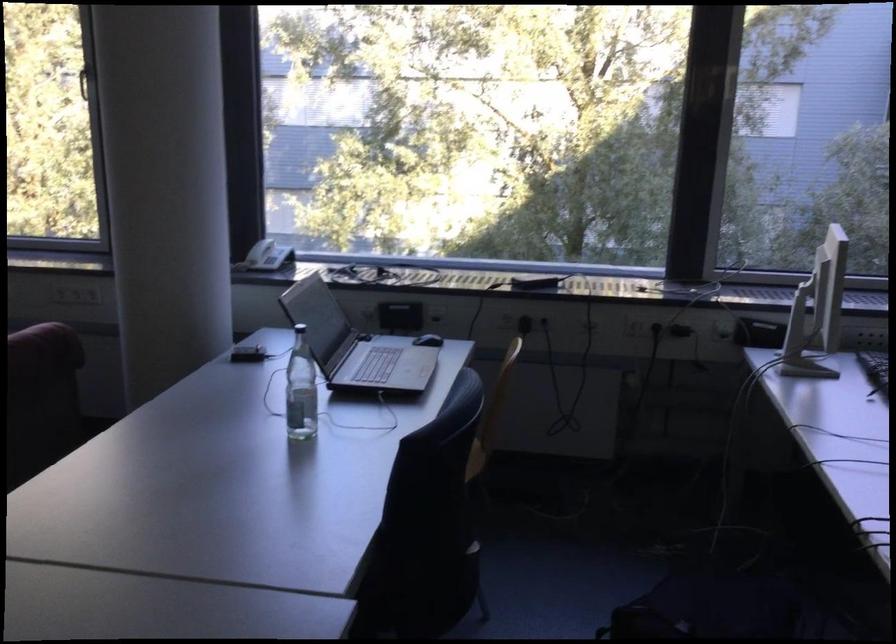
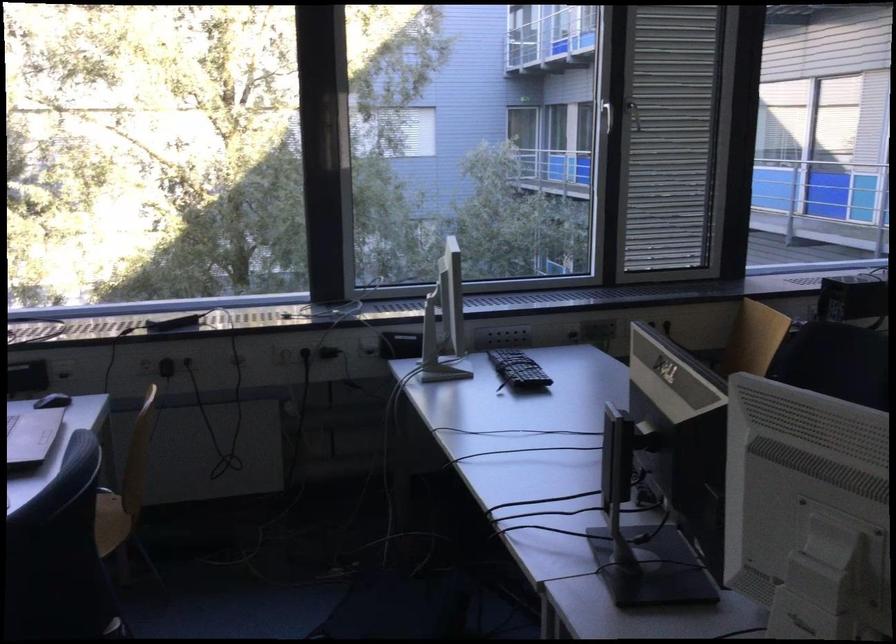
Question: How did the camera likely rotate?

Choices:
 (A) Left
 (B) Right
 (C) Up
 (D) Down

Answer: (B)